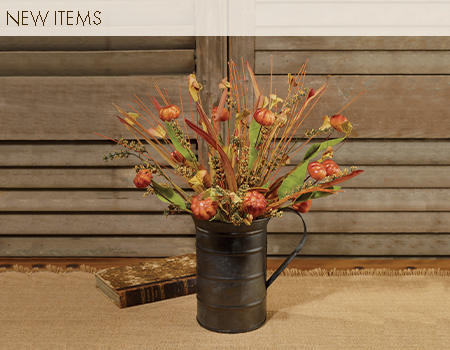
Identify the location of old book. The width and height of the screenshot is (450, 350). (142, 281).